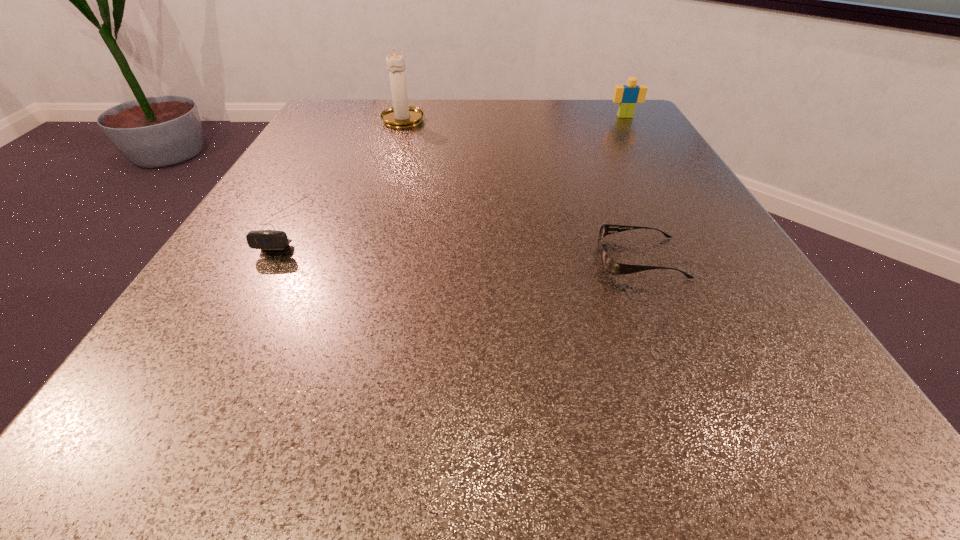
Locate an element on the screen. object that stands as the closest to the sunglasses is located at coordinates (266, 240).

You are a GUI agent. You are given a task and a screenshot of the screen. Output one action in this format:
    pyautogui.click(x=<x>, y=<y>)
    Task: Click on the object identified as the third closest to the leftmost object
    Image resolution: width=960 pixels, height=540 pixels.
    Given the screenshot: What is the action you would take?
    pyautogui.click(x=627, y=96)

Locate an element on the screen. This screenshot has width=960, height=540. free space that satisfies the following two spatial constraints: 1. on the face of the rightmost object; 2. on the front-facing side of the second object from right to left is located at coordinates (711, 258).

The width and height of the screenshot is (960, 540). I want to click on free region that satisfies the following two spatial constraints: 1. on the face of the Lego; 2. on the front-facing side of the sunglasses, so 711,258.